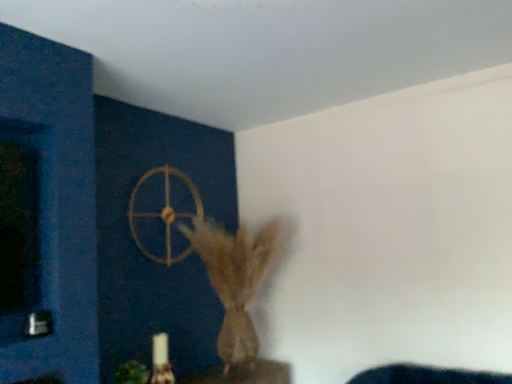
Question: Can you confirm if brown textured vase at center is positioned to the left of green matte plant at lower left?

Choices:
 (A) no
 (B) yes

Answer: (A)

Question: From the image's perspective, is brown textured vase at center located above green matte plant at lower left?

Choices:
 (A) yes
 (B) no

Answer: (A)

Question: Is brown textured vase at center positioned behind green matte plant at lower left?

Choices:
 (A) no
 (B) yes

Answer: (B)

Question: Does brown textured vase at center have a greater width compared to green matte plant at lower left?

Choices:
 (A) yes
 (B) no

Answer: (A)

Question: Is brown textured vase at center not close to green matte plant at lower left?

Choices:
 (A) no
 (B) yes

Answer: (A)

Question: Is brown textured vase at center to the right of green matte plant at lower left from the viewer's perspective?

Choices:
 (A) no
 (B) yes

Answer: (B)

Question: Does green matte plant at lower left have a larger size compared to gold metallic wheel at upper center?

Choices:
 (A) yes
 (B) no

Answer: (B)

Question: Is green matte plant at lower left to the left of gold metallic wheel at upper center from the viewer's perspective?

Choices:
 (A) yes
 (B) no

Answer: (A)

Question: Is the position of green matte plant at lower left more distant than that of gold metallic wheel at upper center?

Choices:
 (A) yes
 (B) no

Answer: (B)

Question: Is green matte plant at lower left taller than gold metallic wheel at upper center?

Choices:
 (A) no
 (B) yes

Answer: (A)

Question: Can you confirm if green matte plant at lower left is thinner than gold metallic wheel at upper center?

Choices:
 (A) no
 (B) yes

Answer: (A)

Question: From the image's perspective, does green matte plant at lower left appear higher than gold metallic wheel at upper center?

Choices:
 (A) yes
 (B) no

Answer: (B)

Question: Is gold metallic wheel at upper center not close to brown textured vase at center?

Choices:
 (A) yes
 (B) no

Answer: (B)